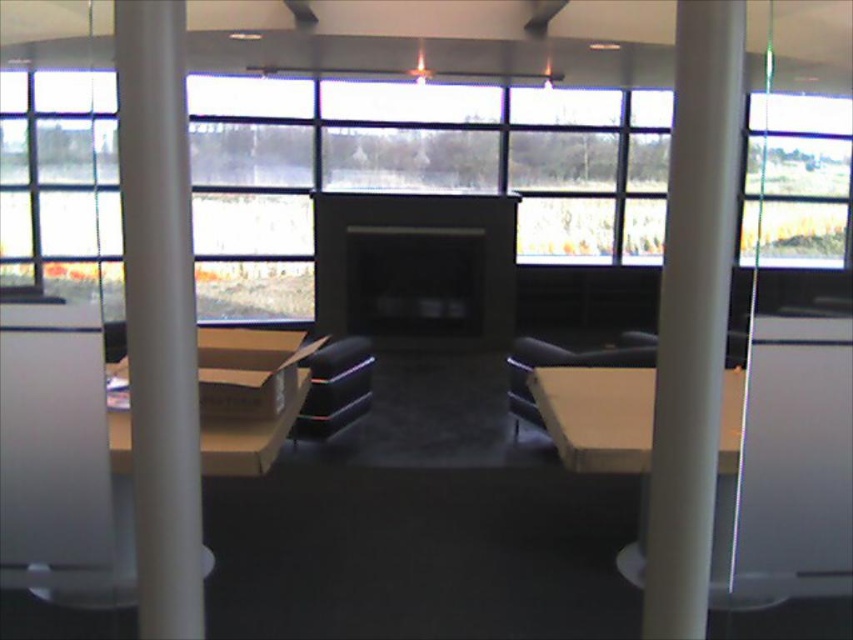
Does white glossy pillar at left have a greater width compared to matte cardboard table at lower left?

In fact, white glossy pillar at left might be narrower than matte cardboard table at lower left.

Which of these two, white glossy pillar at left or matte cardboard table at lower left, stands taller?

With more height is white glossy pillar at left.

Locate an element on the screen. white glossy pillar at left is located at coordinates (160, 314).

Image resolution: width=853 pixels, height=640 pixels. Describe the element at coordinates (693, 314) in the screenshot. I see `white smooth pillar at center` at that location.

Between point (664, 428) and point (334, 388), which one is positioned in front?

Positioned in front is point (664, 428).

This screenshot has width=853, height=640. I want to click on white smooth pillar at center, so click(x=693, y=314).

Which of these two, black leather chair at center or matte black chair at center, stands shorter?

black leather chair at center

Can you confirm if black leather chair at center is shorter than matte black chair at center?

Correct, black leather chair at center is not as tall as matte black chair at center.

Where is `black leather chair at center`? black leather chair at center is located at coordinates (335, 387).